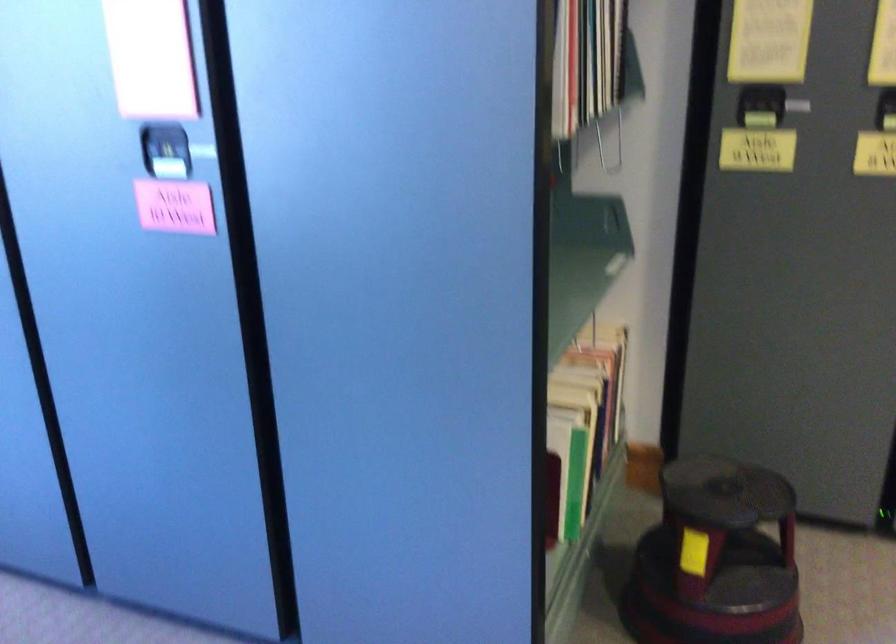
This screenshot has height=644, width=896. I want to click on step stool surface, so click(725, 491).